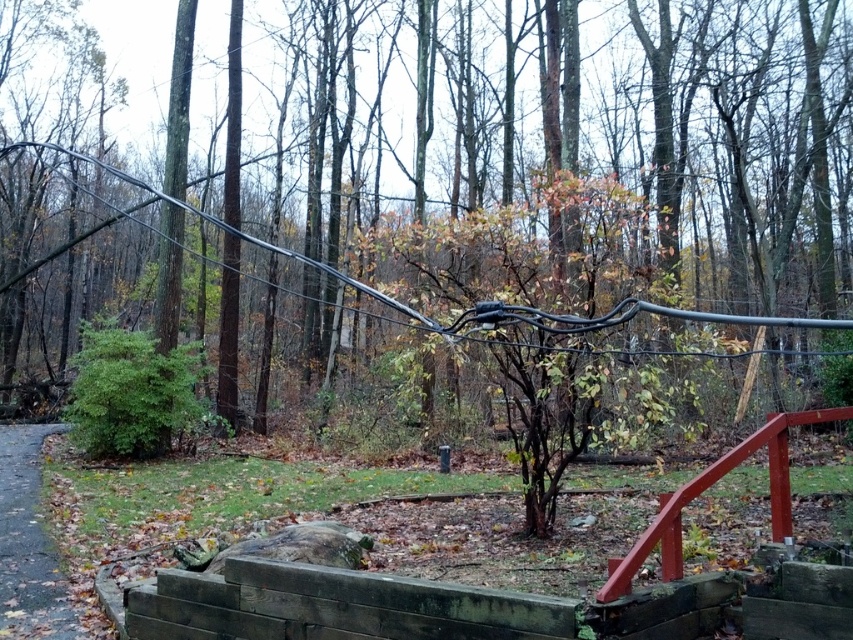
Question: Which point is farther from the camera taking this photo?

Choices:
 (A) (0, 438)
 (B) (512, 74)

Answer: (B)

Question: Can you confirm if green matte tree at center is bigger than smooth red wooden rail at lower right?

Choices:
 (A) no
 (B) yes

Answer: (B)

Question: Which of the following is the farthest from the observer?

Choices:
 (A) smooth red wooden rail at lower right
 (B) gray asphalt path at lower left

Answer: (B)

Question: Does green matte tree at center lie in front of smooth red wooden rail at lower right?

Choices:
 (A) no
 (B) yes

Answer: (B)

Question: Is gray asphalt path at lower left smaller than smooth red wooden rail at lower right?

Choices:
 (A) yes
 (B) no

Answer: (B)

Question: Which point is closer to the camera?

Choices:
 (A) green matte tree at center
 (B) gray asphalt path at lower left

Answer: (A)